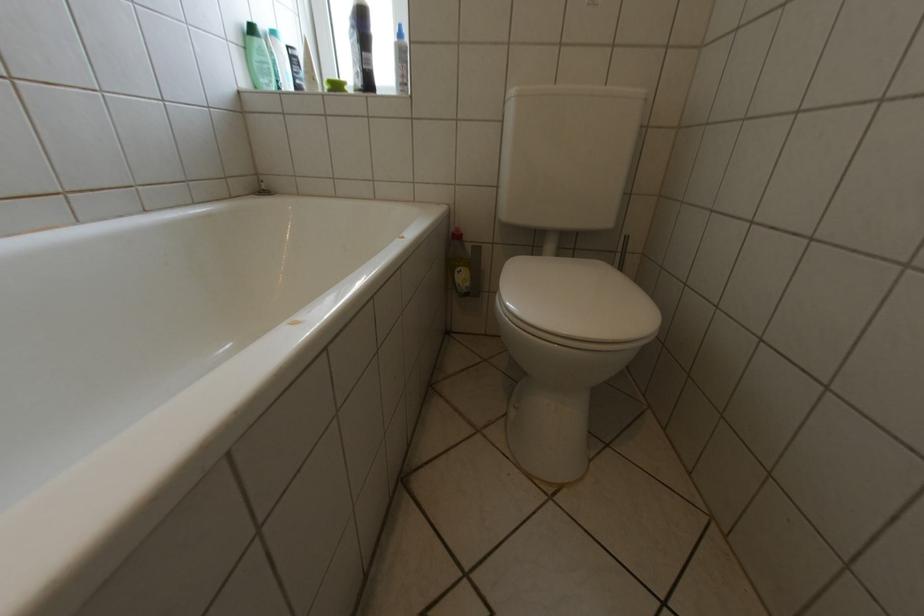
This screenshot has height=616, width=924. Find the location of `light blue bottle`. light blue bottle is located at coordinates (258, 59).